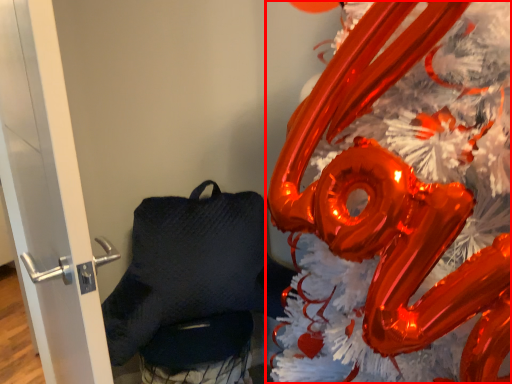
Question: From the image's perspective, where is christmas decoration (annotated by the red box) located in relation to door in the image?

Choices:
 (A) above
 (B) below

Answer: (B)